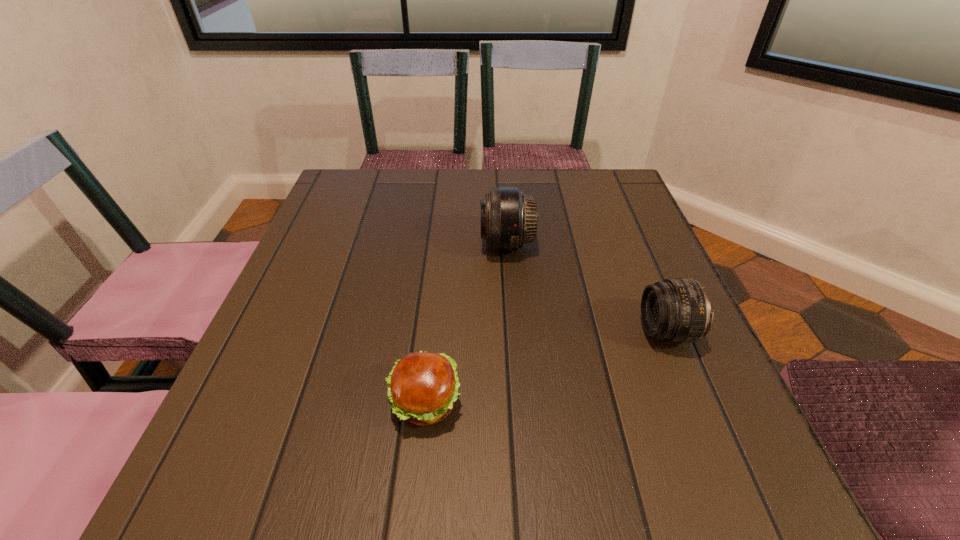
Find the location of a particular element. vacant space at the far right corner of the desktop is located at coordinates (571, 177).

In order to click on empty space between the shortest object and the taller telephoto lens in this screenshot , I will do `click(466, 323)`.

I want to click on empty space between the shortest object and the nearer telephoto lens, so click(x=545, y=367).

Where is `vacant area between the farther telephoto lens and the leftmost object`? The width and height of the screenshot is (960, 540). vacant area between the farther telephoto lens and the leftmost object is located at coordinates (466, 323).

At what (x,y) coordinates should I click in order to perform the action: click on free spot between the second object from right to left and the second tallest object. Please return your answer as a coordinate pair (x, y). This screenshot has width=960, height=540. Looking at the image, I should click on (587, 288).

Where is `vacant area that lies between the shortest object and the second shortest object`? Image resolution: width=960 pixels, height=540 pixels. vacant area that lies between the shortest object and the second shortest object is located at coordinates (545, 367).

Image resolution: width=960 pixels, height=540 pixels. In order to click on vacant region between the hamburger and the second farthest object in this screenshot , I will do `click(545, 367)`.

Locate an element on the screen. The height and width of the screenshot is (540, 960). empty space between the nearest object and the shorter telephoto lens is located at coordinates (545, 367).

Locate an element on the screen. empty space that is in between the farther telephoto lens and the leftmost object is located at coordinates (466, 323).

The image size is (960, 540). Find the location of `vacant space in between the leftmost object and the farther telephoto lens`. vacant space in between the leftmost object and the farther telephoto lens is located at coordinates (466, 323).